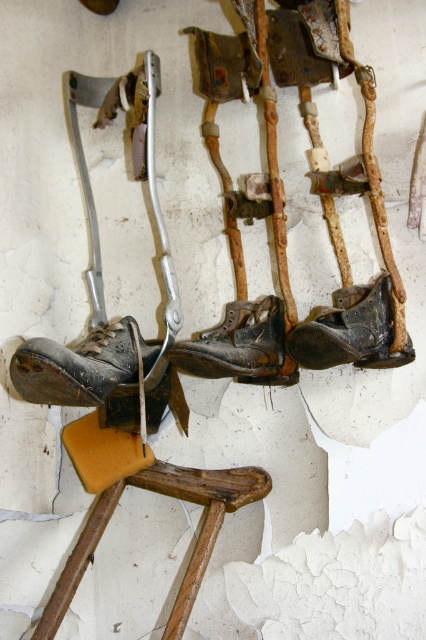
Is shiny black leather shoe at center to the left of dark brown leather shoe at center from the viewer's perspective?

Indeed, shiny black leather shoe at center is positioned on the left side of dark brown leather shoe at center.

Can you confirm if shiny black leather shoe at center is positioned to the right of dark brown leather shoe at center?

No, shiny black leather shoe at center is not to the right of dark brown leather shoe at center.

Which is in front, point (51, 396) or point (359, 321)?

Positioned in front is point (51, 396).

I want to click on shiny black leather shoe at center, so click(x=80, y=365).

Between wooden at center and dark brown leather shoe at center, which one is positioned higher?

dark brown leather shoe at center

Who is positioned more to the right, wooden at center or dark brown leather shoe at center?

Positioned to the right is dark brown leather shoe at center.

In order to click on wooden at center in this screenshot , I will do `click(195, 540)`.

This screenshot has width=426, height=640. Identify the location of wooden at center. (195, 540).

Is wooden at center above leather boot at center?

Incorrect, wooden at center is not positioned above leather boot at center.

Is wooden at center below leather boot at center?

Yes.

Identify the location of wooden at center. This screenshot has height=640, width=426. (195, 540).